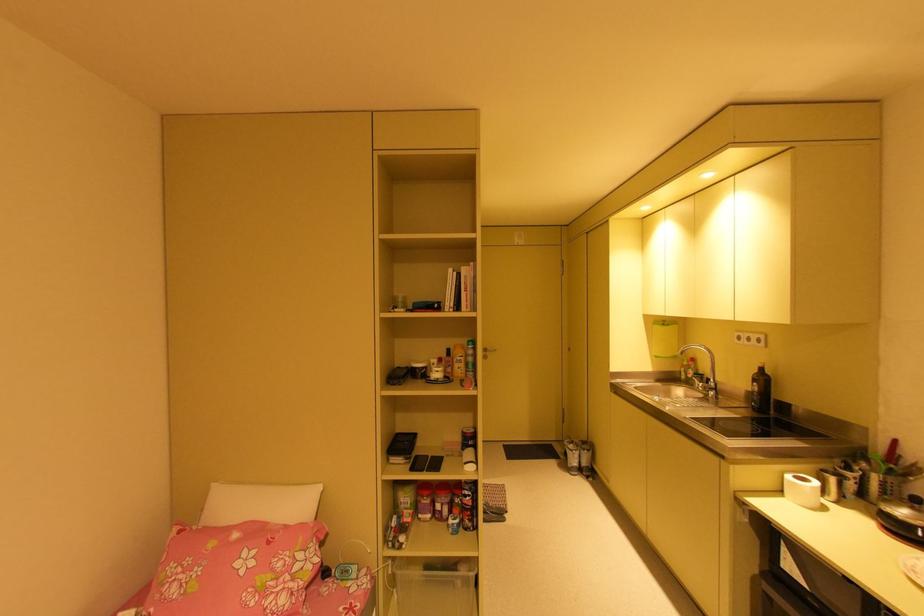
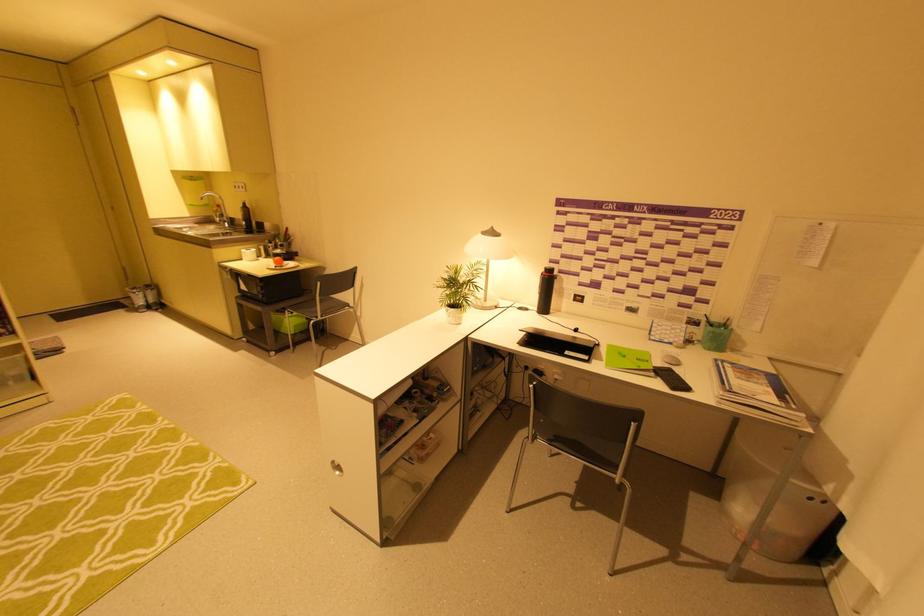
Locate, in the second image, the point that corresponds to point (760, 371) in the first image.

(246, 206)